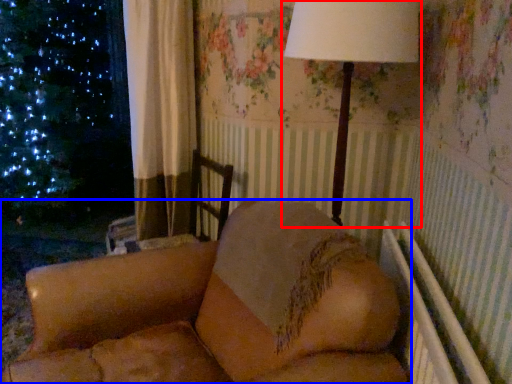
Question: Which object appears farthest to the camera in this image, lamp (highlighted by a red box) or furniture (highlighted by a blue box)?

Choices:
 (A) lamp
 (B) furniture

Answer: (A)